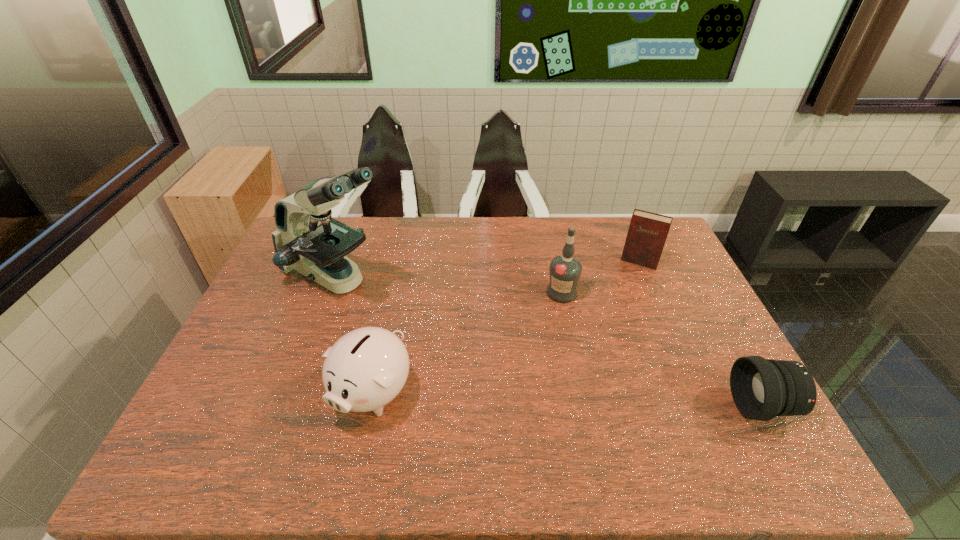
Locate an element on the screen. vacant space on the desktop that is between the piggy bank and the telephoto lens and is positioned on the front label of the third object from left to right is located at coordinates (583, 400).

Locate an element on the screen. vacant space on the desktop that is between the piggy bank and the rightmost object and is positioned on the front cover of the fourth object from left to right is located at coordinates (592, 400).

Where is `vacant space on the desktop that is between the piggy bank and the shortest object and is positioned through the eyepieces of the tallest object`? vacant space on the desktop that is between the piggy bank and the shortest object and is positioned through the eyepieces of the tallest object is located at coordinates (550, 399).